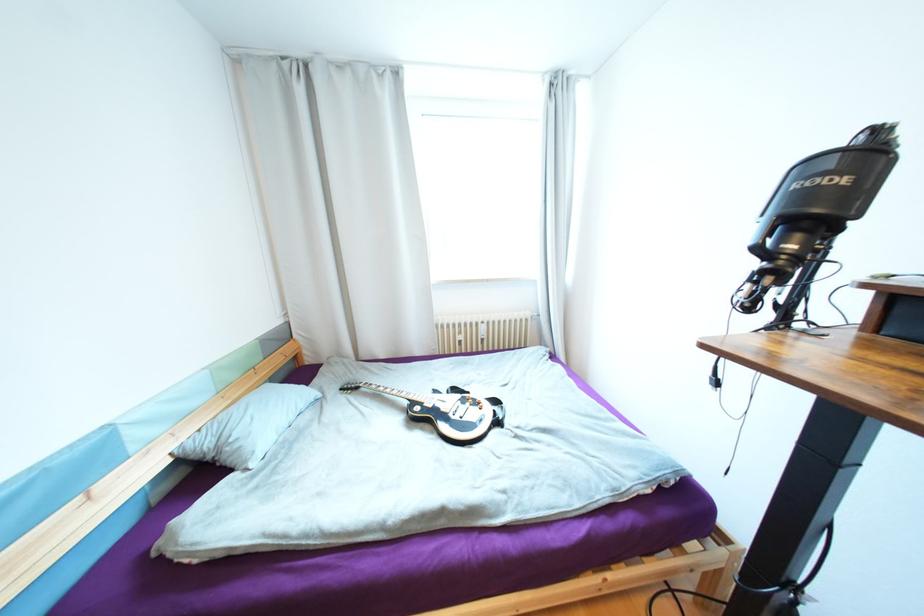
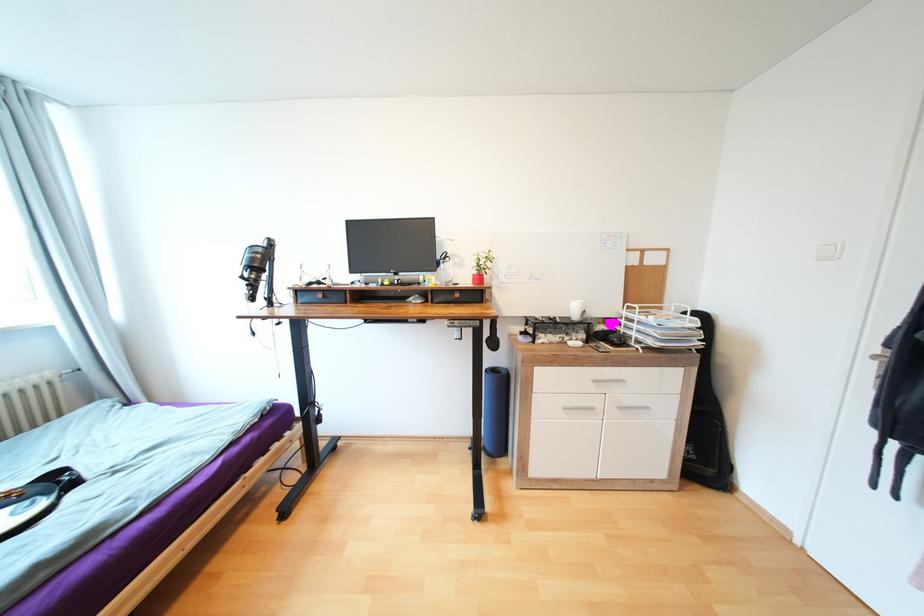
Question: Based on the continuous images, in which direction is the camera rotating? Reply with the corresponding letter.

Choices:
 (A) Left
 (B) Right
 (C) Up
 (D) Down

Answer: (B)